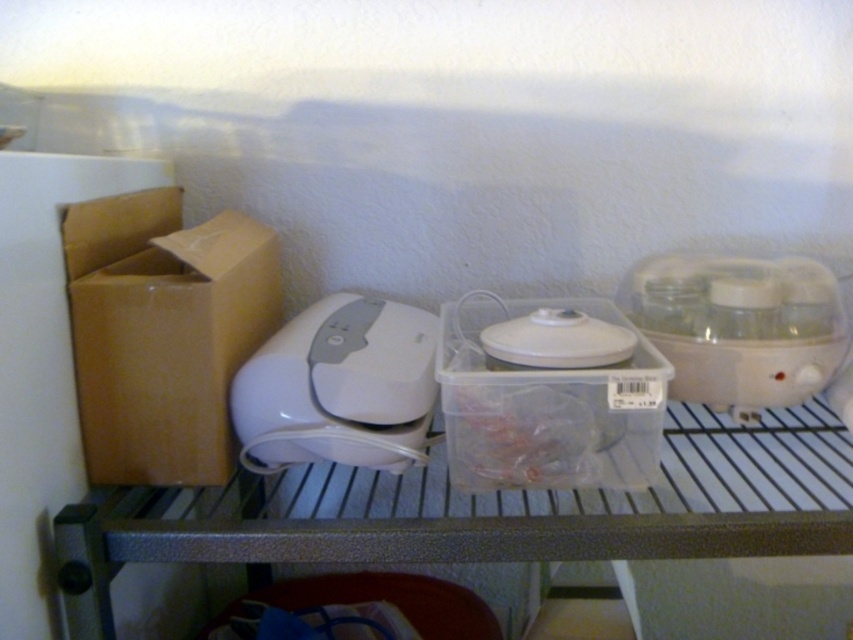
Question: Which is nearer to the white plastic appliance at center?

Choices:
 (A) white plastic food processor at right
 (B) brown cardboard box at left
 (C) transparent plastic container at center

Answer: (B)

Question: Is transparent plastic container at center behind white plastic food processor at right?

Choices:
 (A) no
 (B) yes

Answer: (A)

Question: Can you confirm if transparent plastic container at center is positioned above white plastic appliance at center?

Choices:
 (A) yes
 (B) no

Answer: (A)

Question: Which object is closer to the camera taking this photo?

Choices:
 (A) brown cardboard box at left
 (B) white plastic appliance at center
 (C) transparent plastic container at center

Answer: (C)

Question: Is white plastic appliance at center to the left of white plastic food processor at right from the viewer's perspective?

Choices:
 (A) no
 (B) yes

Answer: (B)

Question: Which of the following is the farthest from the observer?

Choices:
 (A) (215, 442)
 (B) (370, 355)
 (C) (775, 332)
 (D) (445, 424)

Answer: (C)